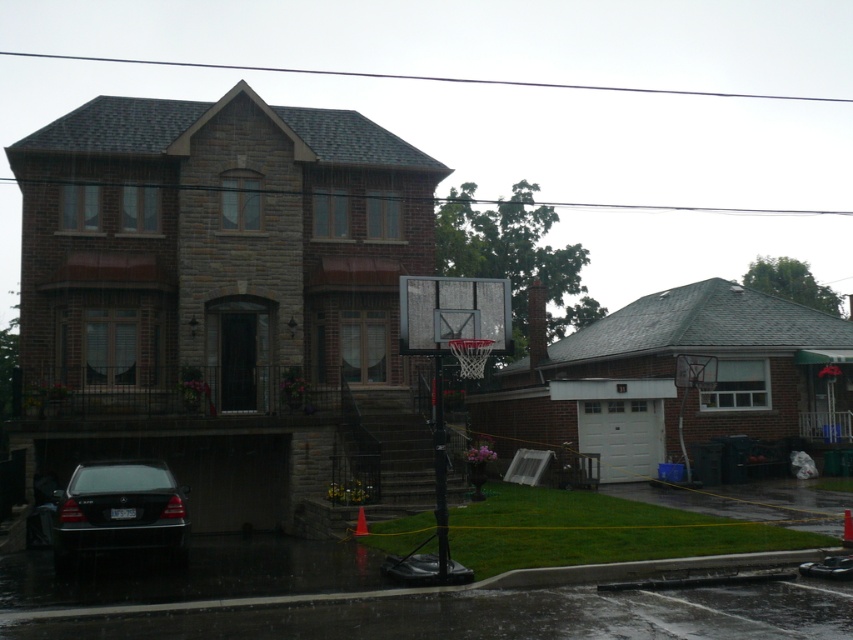
Who is more distant from viewer, [461,332] or [102,508]?

Positioned behind is point [102,508].

Who is more forward, (509,348) or (83,532)?

Point (509,348) is more forward.

Find the location of a particular element. metallic silver basketball hoop at center is located at coordinates (450, 353).